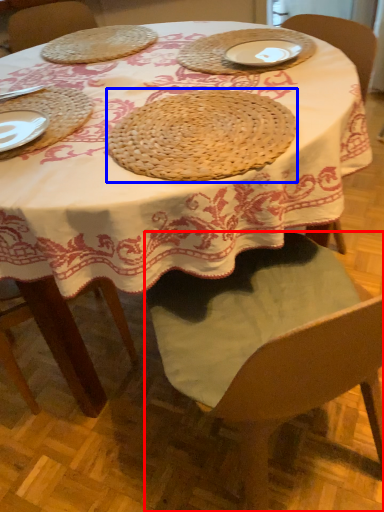
Question: Which point is further to the camera, chair (highlighted by a red box) or pie (highlighted by a blue box)?

Choices:
 (A) chair
 (B) pie

Answer: (B)